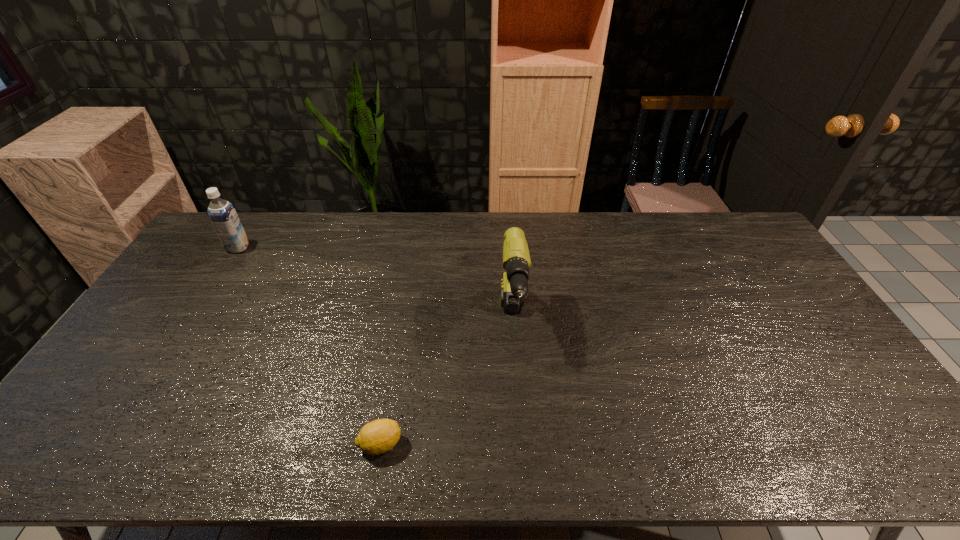
At what (x,y) coordinates should I click in order to perform the action: click on the second nearest object. Please return your answer as a coordinate pair (x, y). The image size is (960, 540). Looking at the image, I should click on (516, 259).

This screenshot has width=960, height=540. In order to click on drill in this screenshot , I will do `click(516, 259)`.

You are a GUI agent. You are given a task and a screenshot of the screen. Output one action in this format:
    pyautogui.click(x=<x>, y=<y>)
    Task: Click on the soya milk
    
    Given the screenshot: What is the action you would take?
    pyautogui.click(x=222, y=214)

Where is `the farthest object`? The height and width of the screenshot is (540, 960). the farthest object is located at coordinates (222, 214).

This screenshot has width=960, height=540. Identify the location of lemon. (381, 435).

Find the location of a particular element. the second object from left to right is located at coordinates (381, 435).

This screenshot has height=540, width=960. I want to click on free point located on the handle side of the second farthest object, so click(517, 394).

What are the coordinates of `free space located on the label of the farthest object` in the screenshot? It's located at (344, 247).

Image resolution: width=960 pixels, height=540 pixels. Find the location of `vacant space located at the stem end of the lemon`. vacant space located at the stem end of the lemon is located at coordinates (470, 444).

Find the location of `object that is at the far edge`. object that is at the far edge is located at coordinates (222, 214).